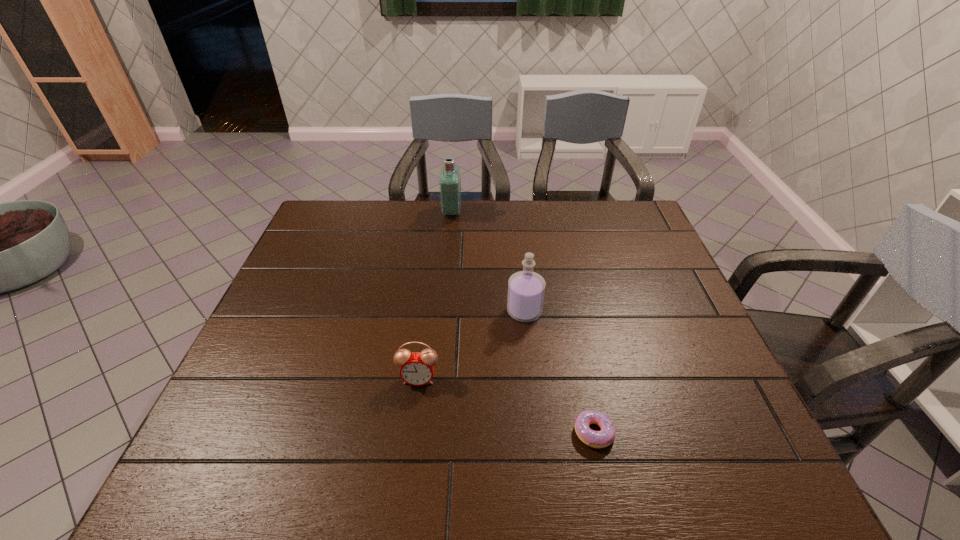
Locate an element on the screen. The height and width of the screenshot is (540, 960). object that ranks as the closest to the third object from left to right is located at coordinates (417, 368).

Locate an element on the screen. The width and height of the screenshot is (960, 540). vacant space that satisfies the following two spatial constraints: 1. on the front label of the left perfume; 2. on the clock face of the second shortest object is located at coordinates (437, 379).

Locate an element on the screen. vacant area in the image that satisfies the following two spatial constraints: 1. on the front label of the farther perfume; 2. on the back side of the nearest object is located at coordinates (432, 433).

What are the coordinates of `free space that satisfies the following two spatial constraints: 1. on the front label of the right perfume; 2. on the right side of the farthest object` in the screenshot? It's located at (443, 312).

Identify the location of vacant space that satisfies the following two spatial constraints: 1. on the back side of the right perfume; 2. on the front label of the left perfume. (514, 212).

Identify the location of vacant space that satisfies the following two spatial constraints: 1. on the clock face of the rightmost object; 2. on the right side of the alarm clock. (412, 433).

You are a GUI agent. You are given a task and a screenshot of the screen. Output one action in this format:
    pyautogui.click(x=<x>, y=<y>)
    Task: Click on the free space that satisfies the following two spatial constraints: 1. on the clock face of the second nearest object; 2. on the left side of the rightmost object
    
    Given the screenshot: What is the action you would take?
    tap(412, 433)

You are a GUI agent. You are given a task and a screenshot of the screen. Output one action in this format:
    pyautogui.click(x=<x>, y=<y>)
    Task: Click on the vacant space that satisfies the following two spatial constraints: 1. on the front label of the left perfume; 2. on the clock face of the third tallest object
    The height and width of the screenshot is (540, 960).
    Given the screenshot: What is the action you would take?
    pyautogui.click(x=437, y=379)

Image resolution: width=960 pixels, height=540 pixels. I want to click on vacant area that satisfies the following two spatial constraints: 1. on the clock face of the alarm clock; 2. on the right side of the shortest object, so click(412, 433).

The height and width of the screenshot is (540, 960). I want to click on free space that satisfies the following two spatial constraints: 1. on the back side of the nearer perfume; 2. on the front label of the farthest object, so click(x=514, y=212).